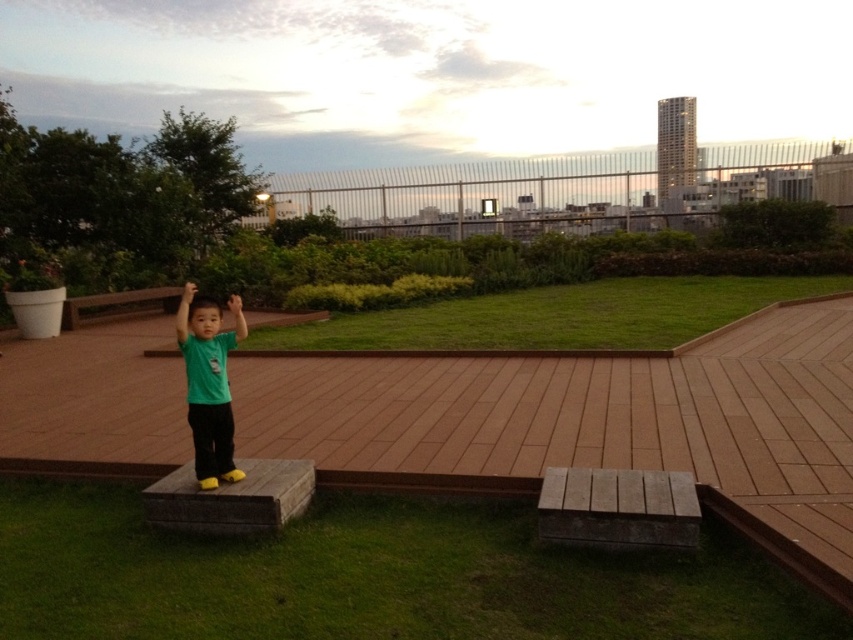
Is brown wood deck at center closer to the viewer compared to green matte shirt at center?

Yes, it is.

Between brown wood deck at center and green matte shirt at center, which one has less height?

green matte shirt at center

Is point (270, 369) positioned in front of point (206, 356)?

That is False.

Where is `brown wood deck at center`? This screenshot has width=853, height=640. brown wood deck at center is located at coordinates (590, 422).